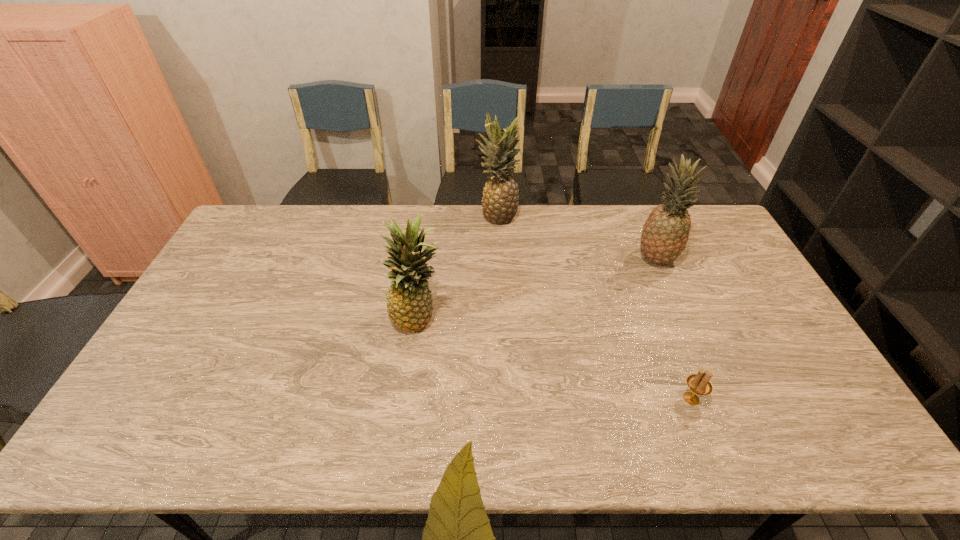
The image size is (960, 540). What are the coordinates of `free spot located 0.070m on the left of the nearest pineapple` in the screenshot? It's located at (366, 319).

You are a GUI agent. You are given a task and a screenshot of the screen. Output one action in this format:
    pyautogui.click(x=<x>, y=<y>)
    Task: Click on the vacant space located 0.260m on the back of the shortest object
    
    Given the screenshot: What is the action you would take?
    pyautogui.click(x=658, y=312)

Identify the location of object at the far edge. (500, 200).

The image size is (960, 540). I want to click on free space at the far edge of the desktop, so click(x=435, y=213).

What are the coordinates of `vacant space at the near edge` in the screenshot? It's located at (256, 453).

I want to click on vacant region at the left edge of the desktop, so click(x=228, y=293).

The width and height of the screenshot is (960, 540). Identify the location of vacant space at the right edge of the desktop. (717, 263).

Image resolution: width=960 pixels, height=540 pixels. In the image, there is a desktop. In order to click on blank space at the far left corner in this screenshot , I will do `click(271, 231)`.

The width and height of the screenshot is (960, 540). I want to click on vacant region at the far right corner of the desktop, so click(694, 228).

Locate an element on the screen. vacant space at the near right corner of the desktop is located at coordinates (811, 426).